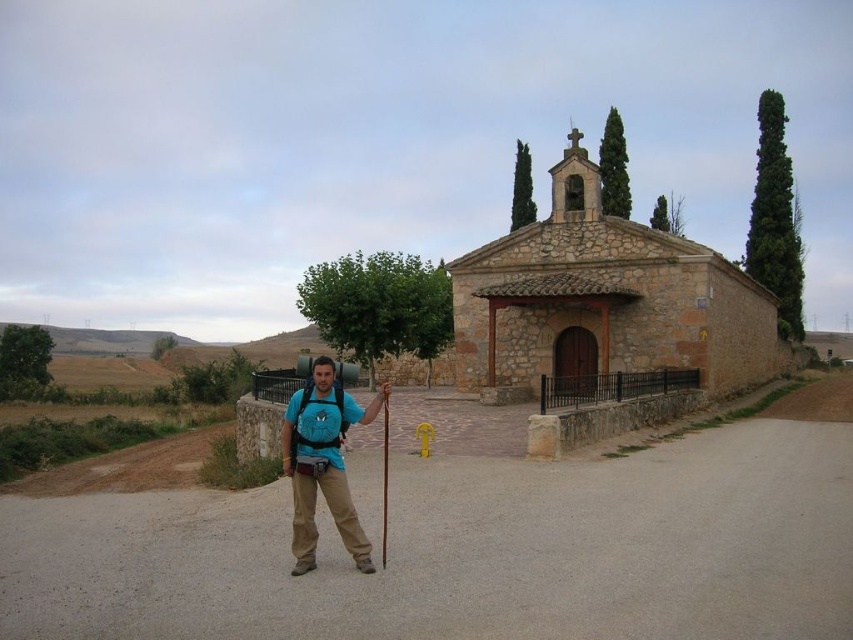
Question: Can you confirm if dirt track at center is smaller than blue fabric backpack at center?

Choices:
 (A) no
 (B) yes

Answer: (A)

Question: Estimate the real-world distances between objects in this image. Which object is closer to the dirt track at center?

Choices:
 (A) blue fabric backpack at center
 (B) brown stone church at center

Answer: (A)

Question: Which point is closer to the camera?

Choices:
 (A) brown stone church at center
 (B) dirt track at center

Answer: (B)

Question: From the image, what is the correct spatial relationship of dirt track at center in relation to blue fabric backpack at center?

Choices:
 (A) above
 (B) below

Answer: (B)

Question: Does brown stone church at center appear under blue fabric backpack at center?

Choices:
 (A) yes
 (B) no

Answer: (B)

Question: Which point is farther to the camera?

Choices:
 (A) brown stone church at center
 (B) dirt track at center

Answer: (A)